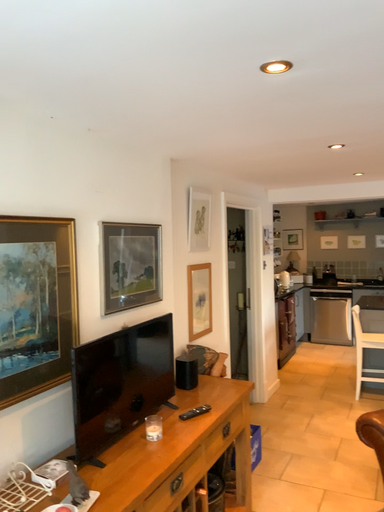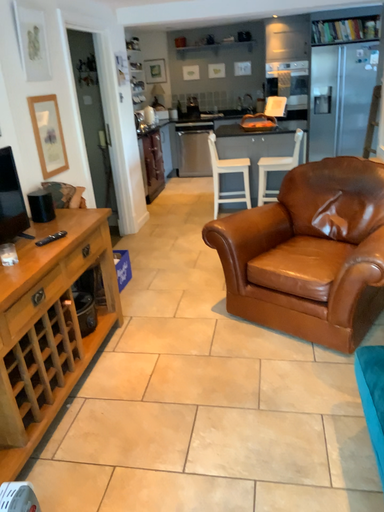
Question: How did the camera likely rotate when shooting the video?

Choices:
 (A) rotated upward
 (B) rotated downward

Answer: (B)